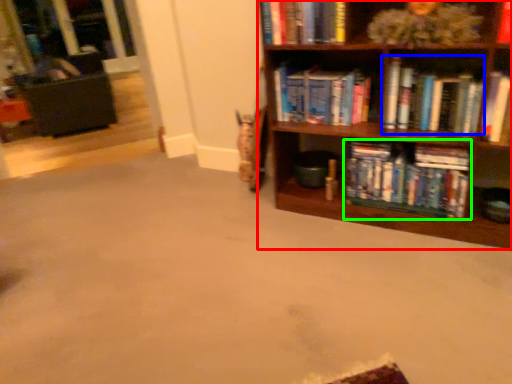
Question: Which is farther away from bookcase (highlighted by a red box)? book (highlighted by a blue box) or book (highlighted by a green box)?

Choices:
 (A) book
 (B) book

Answer: (A)